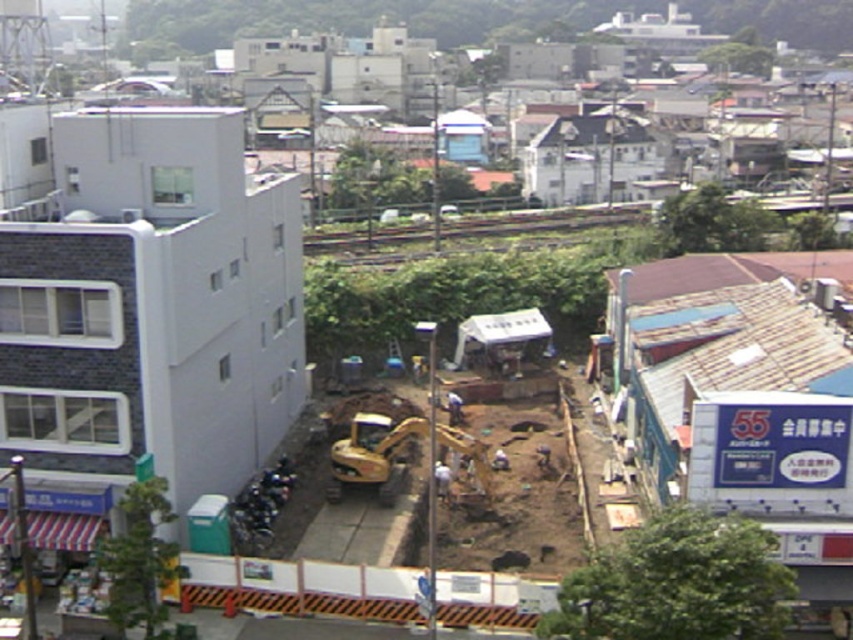
Question: Which point is closer to the camera?

Choices:
 (A) [360, 417]
 (B) [222, 410]
 (C) [445, 468]

Answer: (B)

Question: In this image, where is white fabric construction worker at center located relative to light blue shirt at center?

Choices:
 (A) below
 (B) above

Answer: (A)

Question: Is white fabric construction worker at center bigger than light blue shirt at center?

Choices:
 (A) yes
 (B) no

Answer: (A)

Question: Which point is farther to the camera?

Choices:
 (A) yellow metallic excavator at center
 (B) white fabric construction worker at center
 (C) white matte building at left

Answer: (B)

Question: Estimate the real-world distances between objects in this image. Which object is closer to the white matte building at left?

Choices:
 (A) white fabric construction worker at center
 (B) light blue shirt at center
 (C) yellow metallic excavator at center

Answer: (C)

Question: Considering the relative positions of yellow metallic excavator at center and white fabric construction worker at center in the image provided, where is yellow metallic excavator at center located with respect to white fabric construction worker at center?

Choices:
 (A) below
 (B) above

Answer: (B)